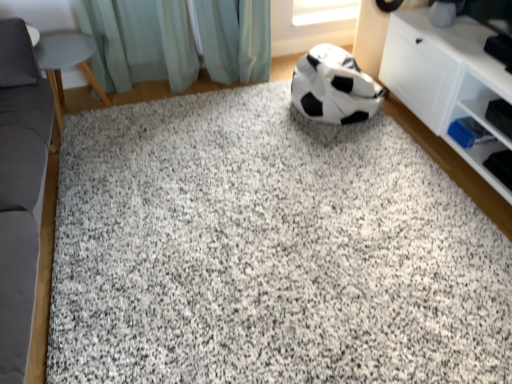
Question: Is matte gray stool at left, which appears as the 1th furniture when viewed from the back, positioned behind granite at center?

Choices:
 (A) yes
 (B) no

Answer: (A)

Question: Is matte gray stool at left, marked as the second furniture in a front-to-back arrangement, positioned in front of granite at center?

Choices:
 (A) yes
 (B) no

Answer: (B)

Question: Is matte gray stool at left, which appears as the 1th furniture when viewed from the back, to the left of granite at center from the viewer's perspective?

Choices:
 (A) yes
 (B) no

Answer: (A)

Question: Considering the relative positions of matte gray stool at left, which appears as the 1th furniture when viewed from the back, and granite at center in the image provided, is matte gray stool at left, which appears as the 1th furniture when viewed from the back, to the right of granite at center from the viewer's perspective?

Choices:
 (A) no
 (B) yes

Answer: (A)

Question: Are matte gray stool at left, which appears as the 1th furniture when viewed from the back, and granite at center beside each other?

Choices:
 (A) no
 (B) yes

Answer: (A)

Question: Considering the positions of point tap(371, 97) and point tap(229, 74), is point tap(371, 97) closer or farther from the camera than point tap(229, 74)?

Choices:
 (A) farther
 (B) closer

Answer: (B)

Question: From a real-world perspective, relative to light teal fabric at upper center, is black/white matte football at center vertically above or below?

Choices:
 (A) above
 (B) below

Answer: (B)

Question: Do you think black/white matte football at center is within light teal fabric at upper center, or outside of it?

Choices:
 (A) inside
 (B) outside

Answer: (B)

Question: Is black/white matte football at center wider or thinner than light teal fabric at upper center?

Choices:
 (A) thin
 (B) wide

Answer: (B)

Question: From the image's perspective, is matte gray stool at left, marked as the second furniture in a front-to-back arrangement, located above or below black/white matte football at center?

Choices:
 (A) above
 (B) below

Answer: (B)

Question: Which is correct: matte gray stool at left, which appears as the 1th furniture when viewed from the back, is inside black/white matte football at center, or outside of it?

Choices:
 (A) inside
 (B) outside

Answer: (B)

Question: Is point (56, 96) positioned closer to the camera than point (361, 119)?

Choices:
 (A) closer
 (B) farther

Answer: (B)

Question: Is matte gray stool at left, which appears as the 1th furniture when viewed from the back, wider or thinner than black/white matte football at center?

Choices:
 (A) thin
 (B) wide

Answer: (A)

Question: Is light teal fabric at upper center wider or thinner than granite at center?

Choices:
 (A) wide
 (B) thin

Answer: (B)

Question: From a real-world perspective, is light teal fabric at upper center physically located above or below granite at center?

Choices:
 (A) below
 (B) above

Answer: (B)